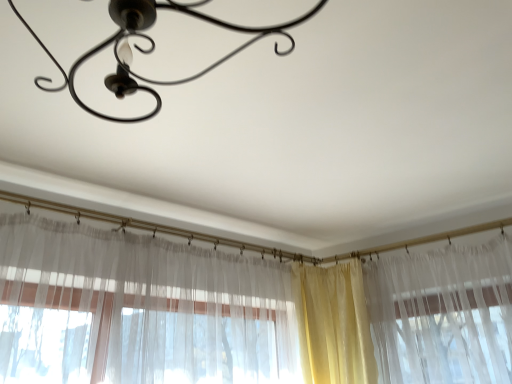
Question: Considering their positions, is yellow sheer curtain at center located in front of or behind metallic chandelier at upper center?

Choices:
 (A) front
 (B) behind

Answer: (B)

Question: Is point (301, 281) closer or farther from the camera than point (117, 1)?

Choices:
 (A) closer
 (B) farther

Answer: (B)

Question: Considering the positions of yellow sheer curtain at center and metallic chandelier at upper center in the image, is yellow sheer curtain at center bigger or smaller than metallic chandelier at upper center?

Choices:
 (A) small
 (B) big

Answer: (A)

Question: Looking at their shapes, would you say metallic chandelier at upper center is wider or thinner than yellow sheer curtain at center?

Choices:
 (A) thin
 (B) wide

Answer: (B)

Question: Looking at the image, does metallic chandelier at upper center seem bigger or smaller compared to yellow sheer curtain at center?

Choices:
 (A) big
 (B) small

Answer: (A)

Question: Considering the relative positions of metallic chandelier at upper center and yellow sheer curtain at center in the image provided, is metallic chandelier at upper center to the left or to the right of yellow sheer curtain at center?

Choices:
 (A) left
 (B) right

Answer: (A)

Question: Which is correct: metallic chandelier at upper center is inside yellow sheer curtain at center, or outside of it?

Choices:
 (A) outside
 (B) inside

Answer: (A)